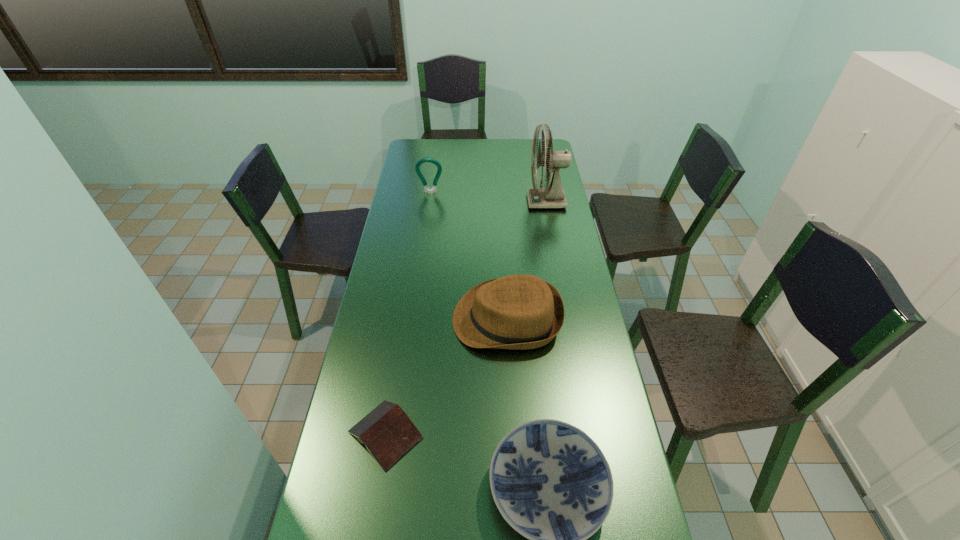
Image resolution: width=960 pixels, height=540 pixels. Identify the location of fan. (553, 196).

What are the coordinates of `the second tallest object` in the screenshot? It's located at (417, 167).

You are a GUI agent. You are given a task and a screenshot of the screen. Output one action in this format:
    pyautogui.click(x=<x>, y=<y>)
    Task: Click on the fedora
    
    Given the screenshot: What is the action you would take?
    pyautogui.click(x=519, y=312)

At what (x,y) coordinates should I click in order to perform the action: click on the third shortest object. Please return your answer as a coordinate pair (x, y). Looking at the image, I should click on (519, 312).

This screenshot has width=960, height=540. What are the coordinates of `book` in the screenshot? It's located at (388, 433).

At what (x,y) coordinates should I click in order to perform the action: click on free location located on the front-facing side of the tallest object. Please return your answer as a coordinate pair (x, y). This screenshot has width=960, height=540. Looking at the image, I should click on (467, 201).

Find the location of a particular element. This screenshot has width=960, height=540. free point located 0.210m on the front-facing side of the tallest object is located at coordinates (480, 201).

Locate an element on the screen. free location located 0.280m on the front-facing side of the tallest object is located at coordinates (465, 201).

In order to click on vacant area situated at the jaws of the bottle opener in this screenshot , I will do `click(429, 201)`.

Identify the location of vacant space located 0.150m on the front-facing side of the fedora. (408, 319).